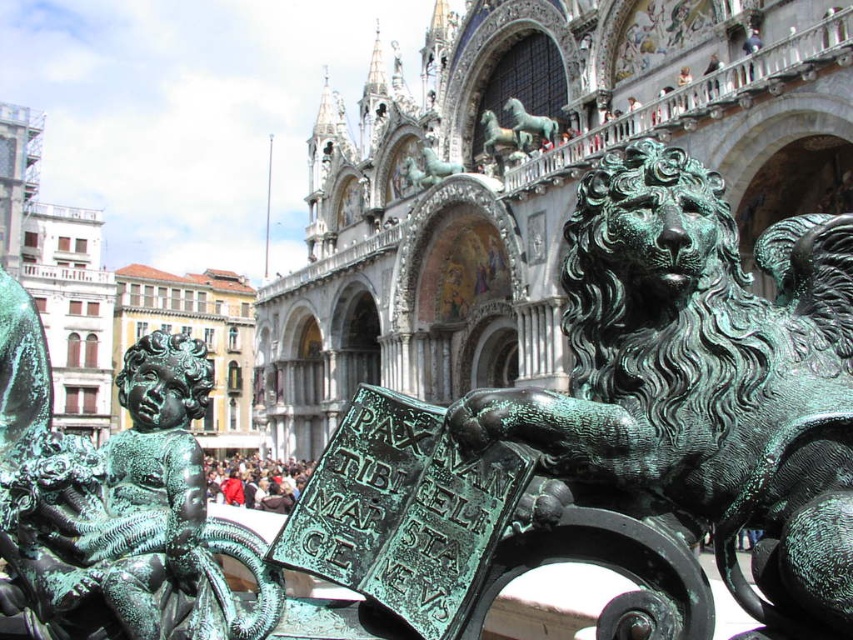
Question: Which of the following is the farthest from the observer?

Choices:
 (A) (193, 500)
 (B) (793, 616)

Answer: (A)

Question: Is green patina lion at center wider than green patina cherub at lower left?

Choices:
 (A) yes
 (B) no

Answer: (A)

Question: Is green patina lion at center smaller than green patina cherub at lower left?

Choices:
 (A) yes
 (B) no

Answer: (B)

Question: Which point is farther from the camera taking this photo?

Choices:
 (A) (790, 291)
 (B) (131, 372)

Answer: (B)

Question: Can you confirm if green patina lion at center is bigger than green patina cherub at lower left?

Choices:
 (A) no
 (B) yes

Answer: (B)

Question: Which point appears farthest from the camera in this image?

Choices:
 (A) (33, 452)
 (B) (602, 467)

Answer: (A)